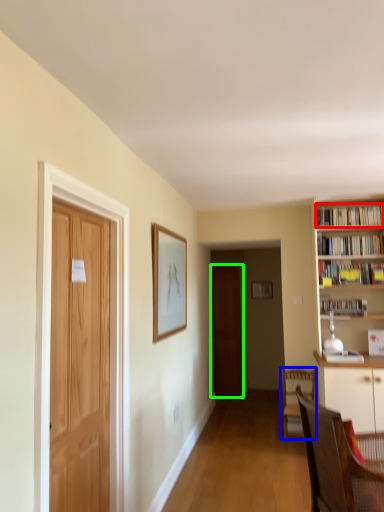
Question: Considering the real-world distances, which object is closest to book (highlighted by a red box)? chair (highlighted by a blue box) or door (highlighted by a green box).

Choices:
 (A) chair
 (B) door

Answer: (A)